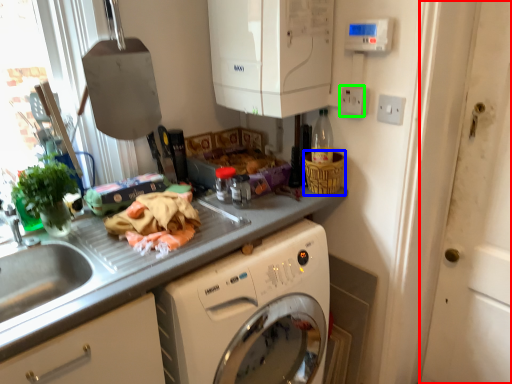
Question: Which object is the closest to the screen door (highlighted by a red box)? Choose among these: basket (highlighted by a blue box) or electric outlet (highlighted by a green box).

Choices:
 (A) basket
 (B) electric outlet

Answer: (A)